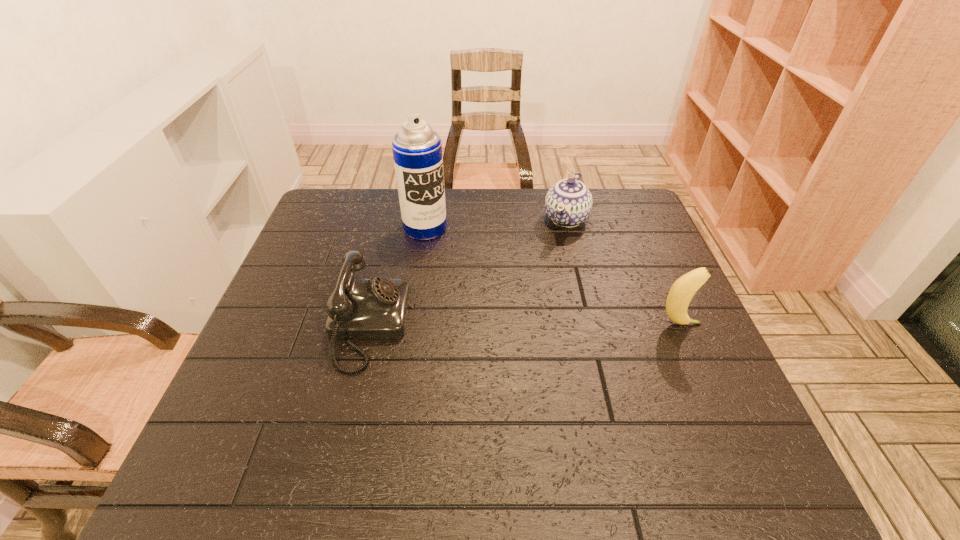
You are a GUI agent. You are given a task and a screenshot of the screen. Output one action in this format:
    pyautogui.click(x=<x>, y=<y>)
    Task: Click on the vacant space situated 0.080m at the spout of the second object from right to left
    This screenshot has height=540, width=960.
    Given the screenshot: What is the action you would take?
    pyautogui.click(x=553, y=255)

Where is `free space located at the spout of the second object from right to left`? free space located at the spout of the second object from right to left is located at coordinates (538, 287).

The width and height of the screenshot is (960, 540). Identify the location of aerosol can at the far edge. (417, 149).

You are a GUI agent. You are given a task and a screenshot of the screen. Output one action in this format:
    pyautogui.click(x=<x>, y=<y>)
    Task: Click on the chinaware that is at the far edge
    This screenshot has height=540, width=960.
    Given the screenshot: What is the action you would take?
    pyautogui.click(x=568, y=203)

The height and width of the screenshot is (540, 960). I want to click on object located in the right edge section of the desktop, so click(683, 289).

Where is `free space at the far edge of the desktop`? free space at the far edge of the desktop is located at coordinates (509, 208).

Image resolution: width=960 pixels, height=540 pixels. What are the coordinates of `blank space at the near edge of the desktop` in the screenshot? It's located at (446, 409).

The image size is (960, 540). I want to click on free space at the left edge of the desktop, so click(308, 240).

This screenshot has height=540, width=960. Find the location of `vacant space at the right edge`. vacant space at the right edge is located at coordinates (700, 342).

This screenshot has height=540, width=960. Find the location of `vacant space at the far left corner`. vacant space at the far left corner is located at coordinates (348, 212).